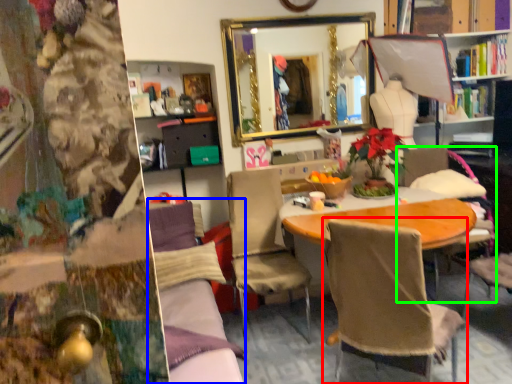
Question: Based on their relative distances, which object is farther from chair (highlighted by a red box)? Choose from couch (highlighted by a blue box) and chair (highlighted by a green box).

Choices:
 (A) couch
 (B) chair

Answer: (B)